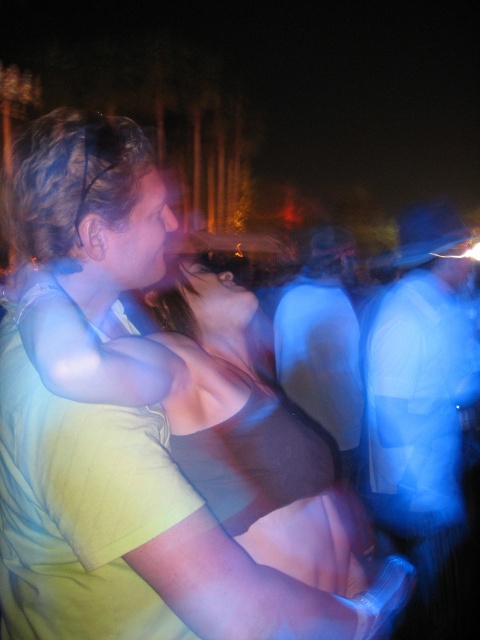
Looking at this image, does blue fabric shirt at right have a greater width compared to matte black shirt at center?

Yes.

The width and height of the screenshot is (480, 640). Describe the element at coordinates (422, 412) in the screenshot. I see `blue fabric shirt at right` at that location.

Is point (462, 538) positioned in front of point (348, 401)?

Yes, it is.

The width and height of the screenshot is (480, 640). I want to click on blue fabric shirt at right, so click(x=422, y=412).

Is matte black tank top at center smaller than blue fabric shirt at right?

Indeed, matte black tank top at center has a smaller size compared to blue fabric shirt at right.

Can you confirm if matte black tank top at center is thinner than blue fabric shirt at right?

Yes, matte black tank top at center is thinner than blue fabric shirt at right.

Between point (308, 449) and point (417, 572), which one is positioned behind?

The point (417, 572) is behind.

The image size is (480, 640). Find the location of `matte black tank top at center`. matte black tank top at center is located at coordinates (254, 436).

Which is more to the right, matte black tank top at center or matte black shirt at center?

From the viewer's perspective, matte black shirt at center appears more on the right side.

Is matte black tank top at center wider than matte black shirt at center?

No.

Measure the distance between point (360, 580) and camera.

Point (360, 580) is 4.32 feet from camera.

This screenshot has height=640, width=480. In order to click on matte black tank top at center in this screenshot , I will do `click(254, 436)`.